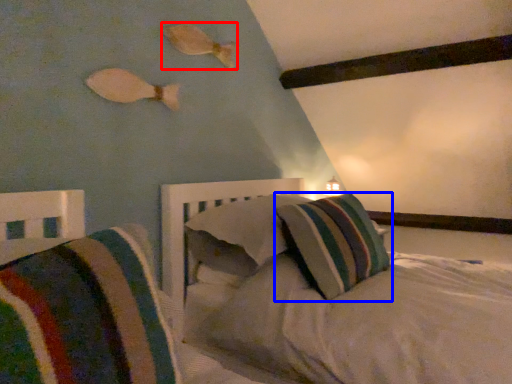
Question: Which of the following is the closest to the observer, fish (highlighted by a red box) or pillow (highlighted by a blue box)?

Choices:
 (A) fish
 (B) pillow

Answer: (B)